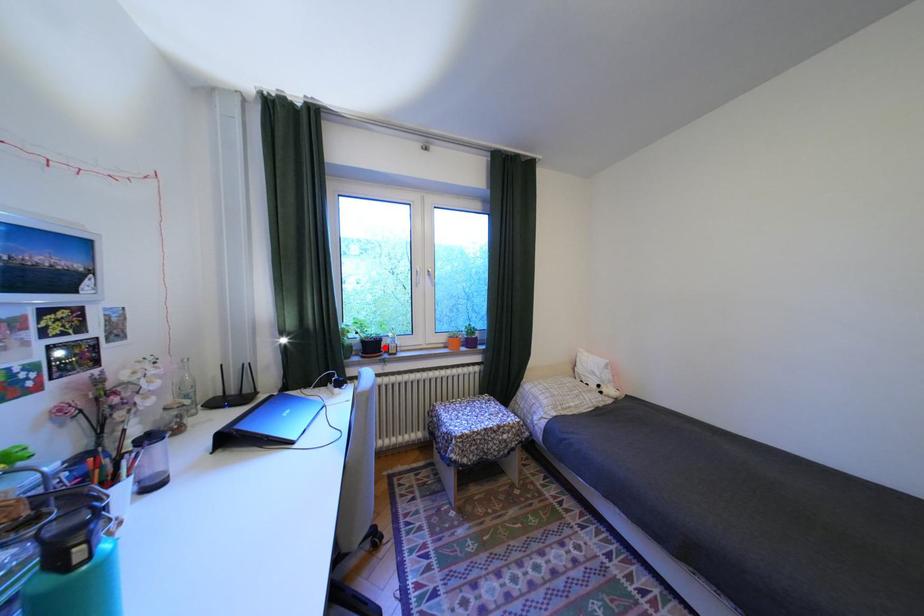
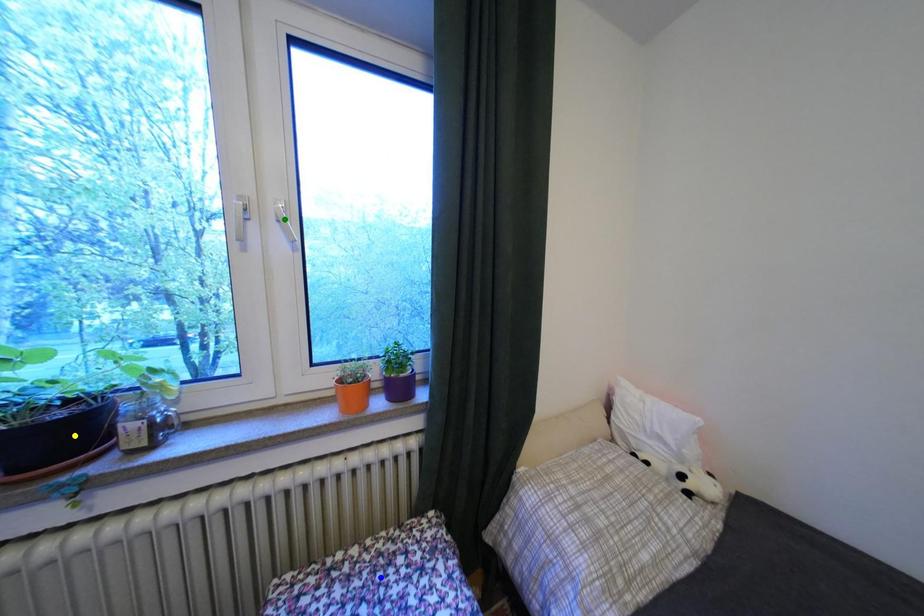
Question: I am providing you with two images of the same scene from different viewpoints. A red point is marked on the first image. You are given multiple points on the second image. Which mark in image 2 goes with the point in image 1?

Choices:
 (A) yellow point
 (B) blue point
 (C) green point

Answer: (A)